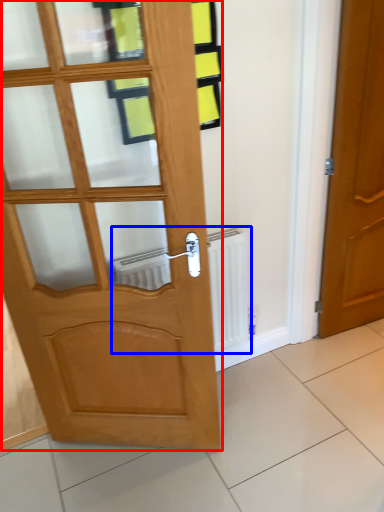
Question: Which of the following is the closest to the observer, door (highlighted by a red box) or radiator (highlighted by a blue box)?

Choices:
 (A) door
 (B) radiator

Answer: (A)